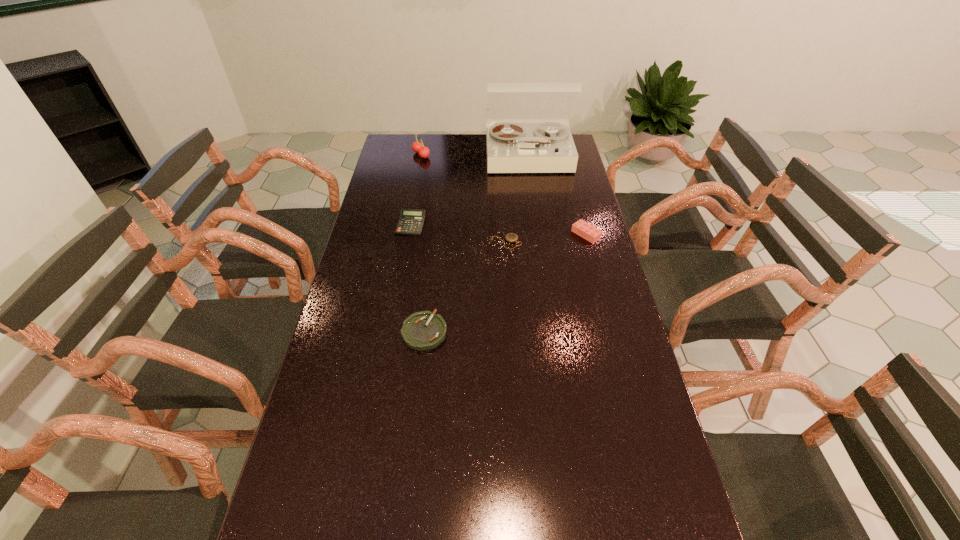
The height and width of the screenshot is (540, 960). Find the location of `free area in between the fifth shortest object and the pocket watch`. free area in between the fifth shortest object and the pocket watch is located at coordinates (464, 199).

At what (x,y) coordinates should I click in order to perform the action: click on free space between the tallest object and the second shortest object. Please return your answer as a coordinate pair (x, y). The width and height of the screenshot is (960, 540). Looking at the image, I should click on (476, 245).

Where is `vacant point located between the record player and the calculator`? This screenshot has width=960, height=540. vacant point located between the record player and the calculator is located at coordinates (469, 191).

Locate an element on the screen. This screenshot has height=540, width=960. free space between the tallest object and the cherry is located at coordinates (475, 156).

Find the location of a particular element. This screenshot has height=540, width=960. object that is the closest to the pocket watch is located at coordinates (592, 234).

Point out which object is positioned as the fifth nearest to the second tallest object. Please provide its 2D coordinates. Your answer should be formatted as a tuple, i.e. [(x, y)], where the tuple contains the x and y coordinates of a point satisfying the conditions above.

[(424, 330)]

Locate an element on the screen. free region that satisfies the following two spatial constraints: 1. on the back side of the pocket watch; 2. on the left side of the record player is located at coordinates (500, 157).